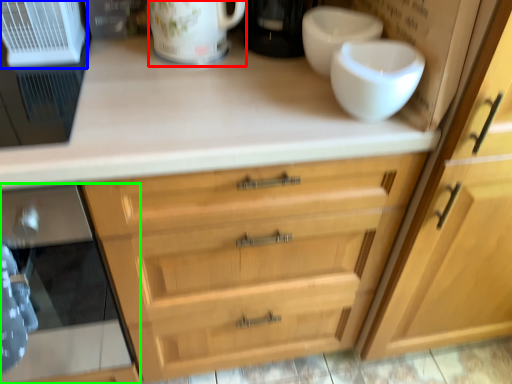
Question: Estimate the real-world distances between objects in this image. Which object is farther from mug (highlighted by a red box), appliance (highlighted by a blue box) or oven (highlighted by a green box)?

Choices:
 (A) appliance
 (B) oven

Answer: (B)